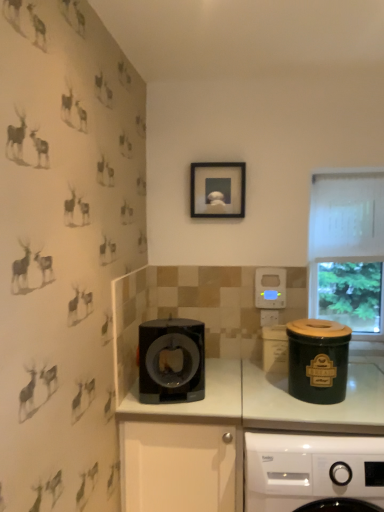
Locate an element on the screen. This screenshot has height=512, width=384. vacant area that is in front of black glossy coffee maker at center is located at coordinates (173, 410).